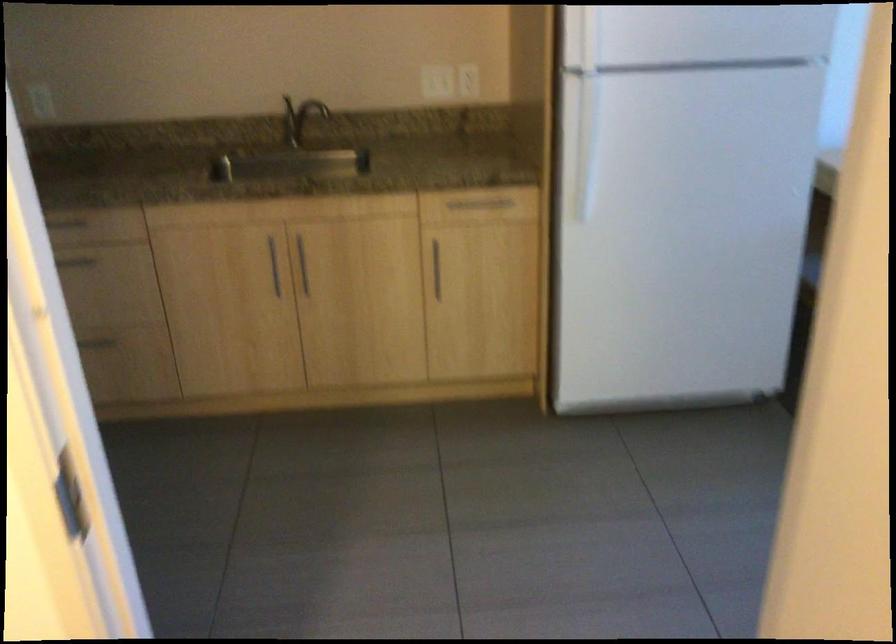
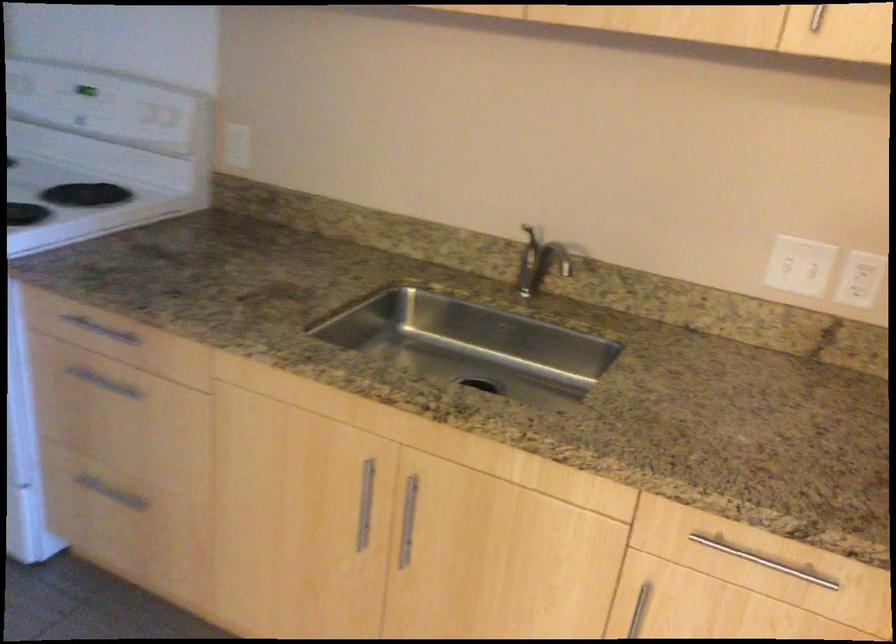
In the second image, find the point that corresponds to point (304, 109) in the first image.

(545, 251)